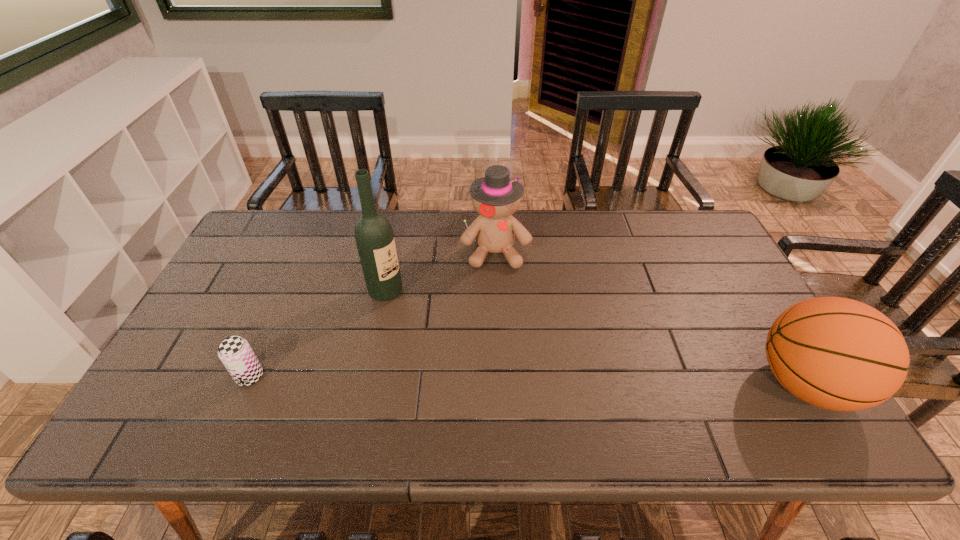
Find the location of a particular element. the shortest object is located at coordinates (236, 354).

The width and height of the screenshot is (960, 540). What are the coordinates of `the leftmost object` in the screenshot? It's located at (236, 354).

Identify the location of the rightmost object. The image size is (960, 540). (836, 353).

Locate an element on the screen. rag_doll is located at coordinates (496, 197).

Locate an element on the screen. The image size is (960, 540). the second object from right to left is located at coordinates (496, 197).

Where is `the third nearest object`? the third nearest object is located at coordinates (374, 237).

Locate an element on the screen. This screenshot has width=960, height=540. wine bottle is located at coordinates (374, 237).

Identify the location of free spot located 0.140m on the left of the beer can. (180, 376).

The image size is (960, 540). I want to click on free spot located 0.250m on the back of the basketball, so click(x=739, y=276).

This screenshot has width=960, height=540. I want to click on free location located on the front-facing side of the farthest object, so click(x=501, y=308).